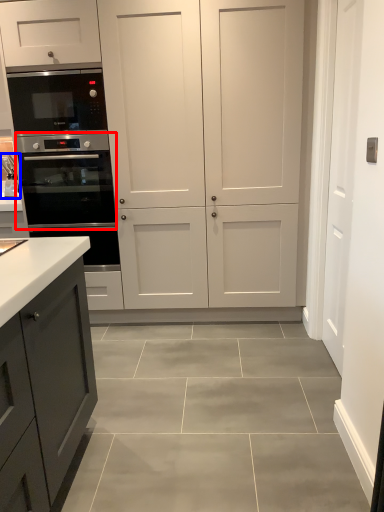
Question: Which object is closer to the camera taking this photo, oven (highlighted by a red box) or sink (highlighted by a blue box)?

Choices:
 (A) oven
 (B) sink

Answer: (A)